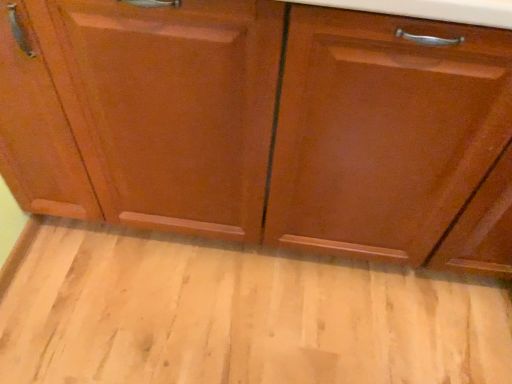
Question: Would you say matte wood floor at lower center is outside glossy wood drawer at right?

Choices:
 (A) no
 (B) yes

Answer: (B)

Question: Does matte wood floor at lower center have a greater width compared to glossy wood drawer at right?

Choices:
 (A) yes
 (B) no

Answer: (A)

Question: Does matte wood floor at lower center have a lesser height compared to glossy wood drawer at right?

Choices:
 (A) no
 (B) yes

Answer: (B)

Question: From the image's perspective, is matte wood floor at lower center over glossy wood drawer at right?

Choices:
 (A) no
 (B) yes

Answer: (A)

Question: Are matte wood floor at lower center and glossy wood drawer at right located far from each other?

Choices:
 (A) yes
 (B) no

Answer: (B)

Question: Is matte wood floor at lower center in front of glossy wood drawer at right?

Choices:
 (A) no
 (B) yes

Answer: (A)

Question: Considering the relative sizes of glossy wood drawer at right and matte wood floor at lower center in the image provided, is glossy wood drawer at right wider than matte wood floor at lower center?

Choices:
 (A) yes
 (B) no

Answer: (B)

Question: Is glossy wood drawer at right placed right next to matte wood floor at lower center?

Choices:
 (A) yes
 (B) no

Answer: (B)

Question: Would you say glossy wood drawer at right is outside matte wood floor at lower center?

Choices:
 (A) yes
 (B) no

Answer: (A)

Question: Would you say glossy wood drawer at right contains matte wood floor at lower center?

Choices:
 (A) yes
 (B) no

Answer: (B)

Question: Is glossy wood drawer at right in front of matte wood floor at lower center?

Choices:
 (A) no
 (B) yes

Answer: (B)

Question: Can you confirm if glossy wood drawer at right is thinner than matte wood floor at lower center?

Choices:
 (A) no
 (B) yes

Answer: (B)

Question: From the image's perspective, is matte wood floor at lower center located above or below glossy wood drawer at right?

Choices:
 (A) below
 (B) above

Answer: (A)